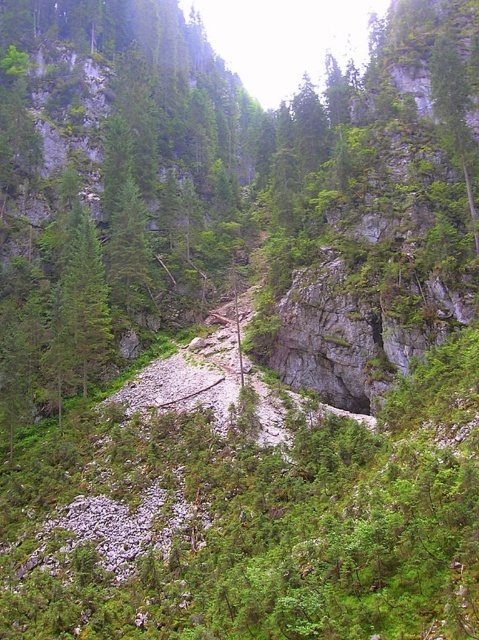
You are a hiker trying to navigate through the mountainous terrain. You see a green matte tree at left and a green leafy tree at center. Which tree would you choose to use as a landmark for your path, and why?

You should choose the green matte tree at left as a landmark because it is taller than the green leafy tree at center, making it more visible from a distance.

You are a hiker planning to take a photo of the green matte tree at left and the green leafy tree at center from a spot along the path. Which tree should you focus on first if you want to capture both in the frame without moving your camera?

The green leafy tree at center is smaller, so focusing on the green matte tree at left first will ensure both fit in the frame since it is larger and closer to the camera.

You are a hiker standing at the base of the mountain. You spot a point marked at coordinates (86, 282) in the scene. If your GPS says you need to reach a point exactly 200 feet away from your current position, is the marked point within your target distance?

The point at coordinates (86, 282) is 185.62 feet away from the viewer. Since 185.62 feet is less than 200 feet, the marked point is within the target distance of 200 feet.